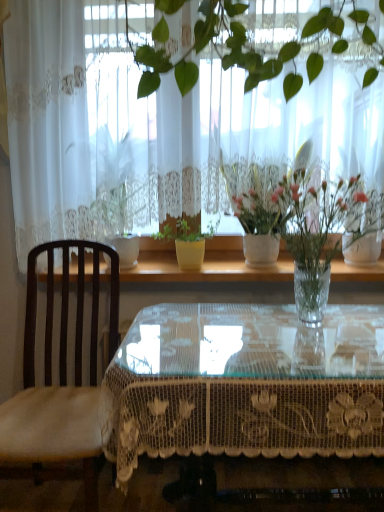
Question: Is dark wood chair at left taller or shorter than white ceramic vase at upper center, which is the 2th houseplant from left to right?

Choices:
 (A) short
 (B) tall

Answer: (B)

Question: Considering their positions, is dark wood chair at left located in front of or behind white ceramic vase at upper center, which is the 2th houseplant from left to right?

Choices:
 (A) front
 (B) behind

Answer: (A)

Question: Estimate the real-world distances between objects in this image. Which object is closer to the white lace curtain at upper center?

Choices:
 (A) transparent lace-covered table at center
 (B) white ceramic vase at upper center, which is the 2th houseplant from left to right
 (C) dark wood chair at left
 (D) white glossy pot at center, acting as the 1th houseplant starting from the left
 (E) transparent glass table at center

Answer: (D)

Question: Which of these objects is positioned closest to the transparent lace-covered table at center?

Choices:
 (A) white ceramic vase at upper center, the 1th houseplant when ordered from right to left
 (B) white lace curtain at upper center
 (C) transparent glass table at center
 (D) dark wood chair at left
 (E) white glossy pot at center, acting as the 1th houseplant starting from the left

Answer: (D)